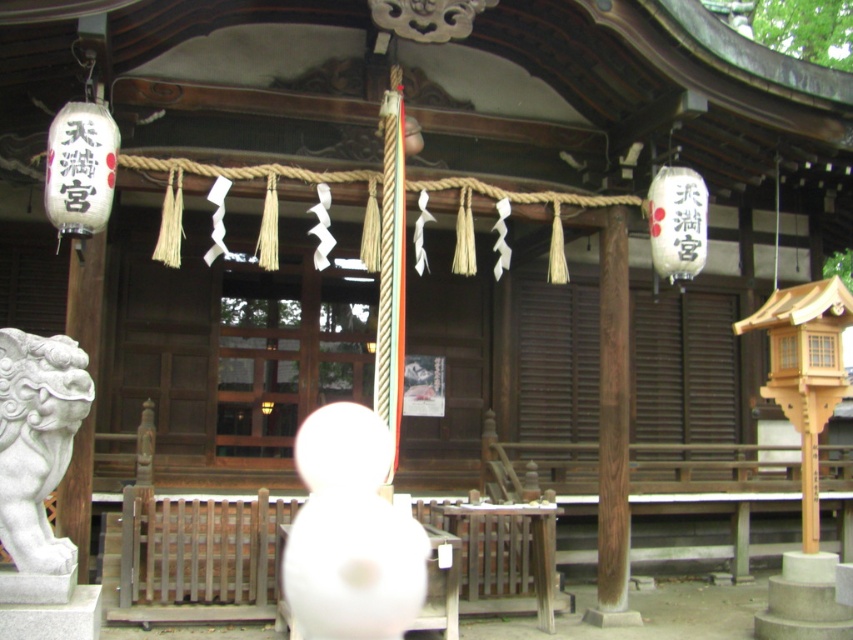
You are standing at the entrance of the shrine and want to place a new decorative lantern at the same horizontal level as the white stone lion at left. What coordinate should you use for the x and y values?

The white stone lion at left is positioned at point (38, 444), so you should place the new decorative lantern at the same x and y coordinates to match its horizontal level.

You are visiting the shrine and want to take a photo of the white stone lion at left and the white paper lantern at left. Which object is positioned to the right side when viewed from the front of the shrine?

The white stone lion at left is positioned to the right of the white paper lantern at left.